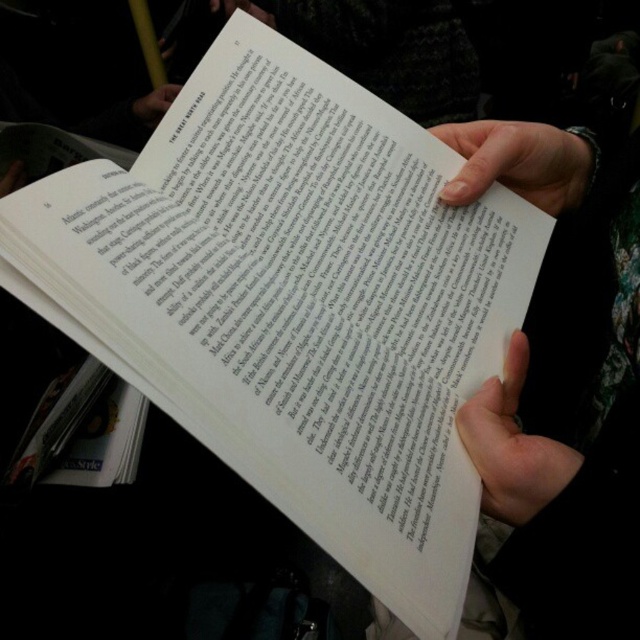
Looking at this image, you are a photographer trying to capture a detailed shot of the white paper at upper center. However, the smooth skin hand at lower right is blocking part of the paper. Can you estimate if the hand is bigger than the paper?

The smooth skin hand at lower right has a larger size compared to white paper at upper center, so yes, the hand is bigger and may block the paper more significantly.

You are a photographer trying to capture a close detail of the book in the image. The smooth skin hand at lower right is in the way. Where should you move your camera to avoid it?

Move the camera to the left of the smooth skin hand at lower right since it is located at point 0.698 on the x axis, so moving left would be towards lower x coordinates.

You are trying to read the text on the matte white paper at upper center but notice the smooth skin hand at upper right is blocking your view. Can you move the hand to see the text better?

The smooth skin hand at upper right is closer to the viewer than the matte white paper at upper center, so moving the hand would allow you to see the text on the matte white paper at upper center more clearly.